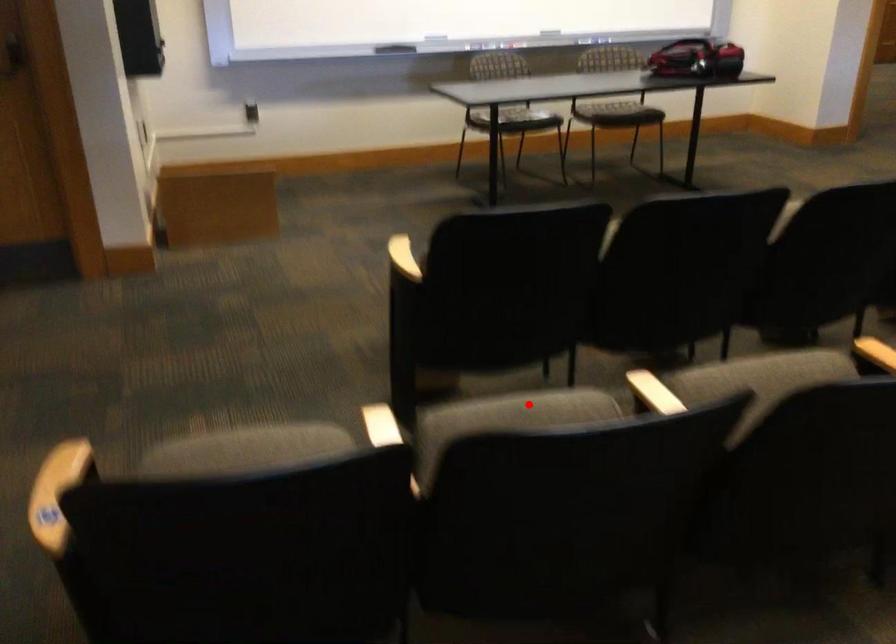
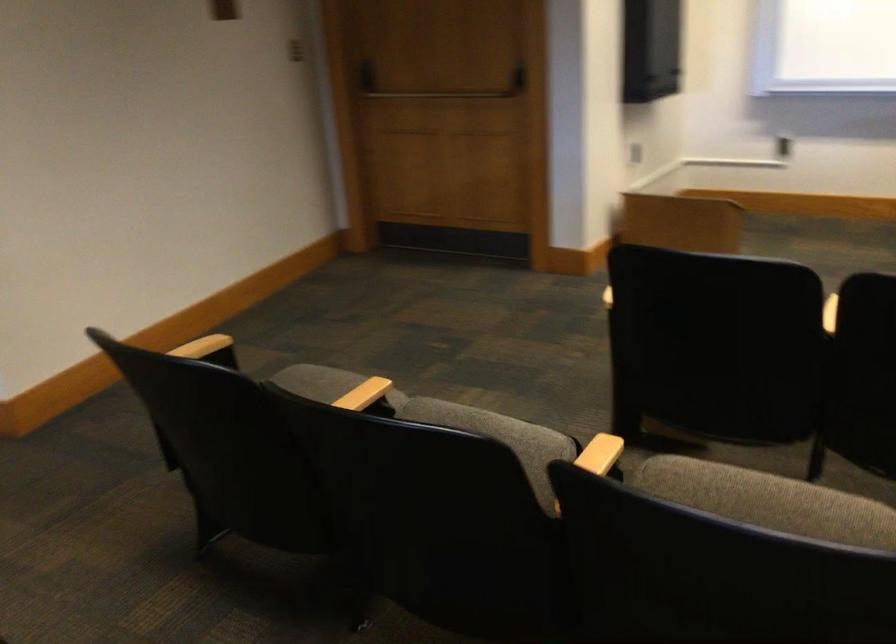
The point at the highlighted location is marked in the first image. Where is the corresponding point in the second image?

(490, 426)